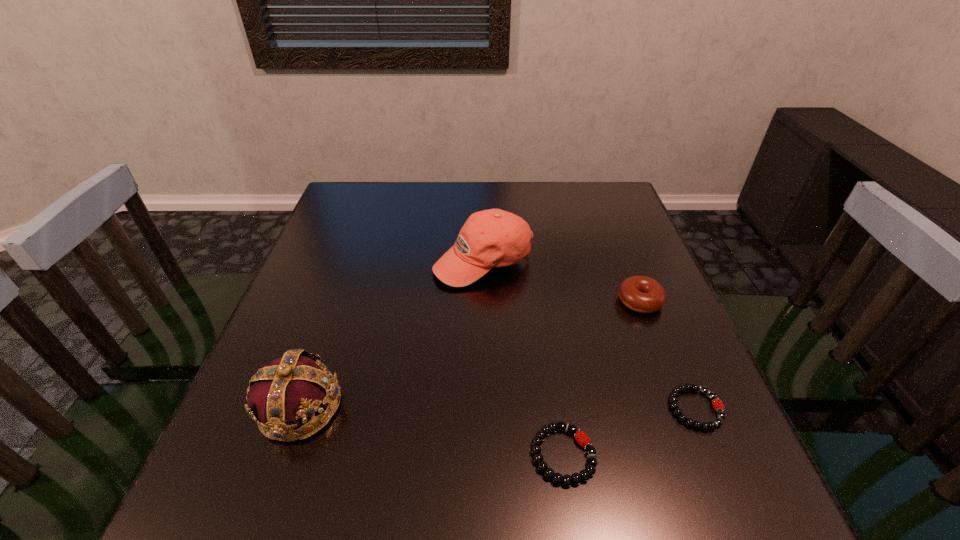
Locate an element on the screen. object that is at the near edge is located at coordinates coord(584,475).

You are a GUI agent. You are given a task and a screenshot of the screen. Output one action in this format:
    pyautogui.click(x=<x>, y=<y>)
    Task: Click on the object located at the left edge
    The width and height of the screenshot is (960, 540).
    Given the screenshot: What is the action you would take?
    pyautogui.click(x=290, y=391)

Locate an element on the screen. This screenshot has width=960, height=540. doughnut situated at the right edge is located at coordinates (642, 294).

I want to click on bracelet that is positioned at the right edge, so click(x=717, y=404).

The width and height of the screenshot is (960, 540). I want to click on free space at the far edge of the desktop, so click(396, 218).

The image size is (960, 540). Identify the location of free region at the left edge. (326, 227).

Identify the location of free space at the right edge of the desktop. click(x=644, y=372).

Where is `free space at the far left corner of the desktop`? This screenshot has height=540, width=960. free space at the far left corner of the desktop is located at coordinates (372, 210).

Image resolution: width=960 pixels, height=540 pixels. In the image, there is a desktop. Identify the location of vacant space at the far right corner. (595, 198).

Locate an element on the screen. free spot between the baseball cap and the third tallest object is located at coordinates (562, 281).